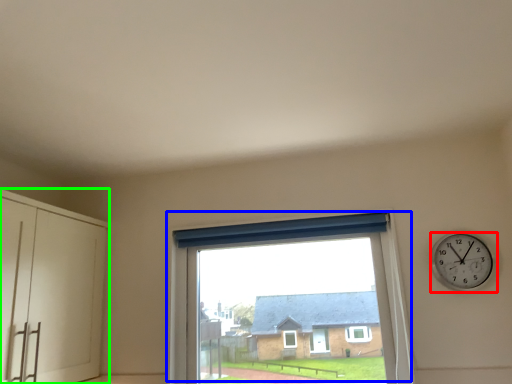
Question: Estimate the real-world distances between objects in this image. Which object is closer to wall clock (highlighted by a red box), window (highlighted by a blue box) or dresser (highlighted by a green box)?

Choices:
 (A) window
 (B) dresser

Answer: (A)